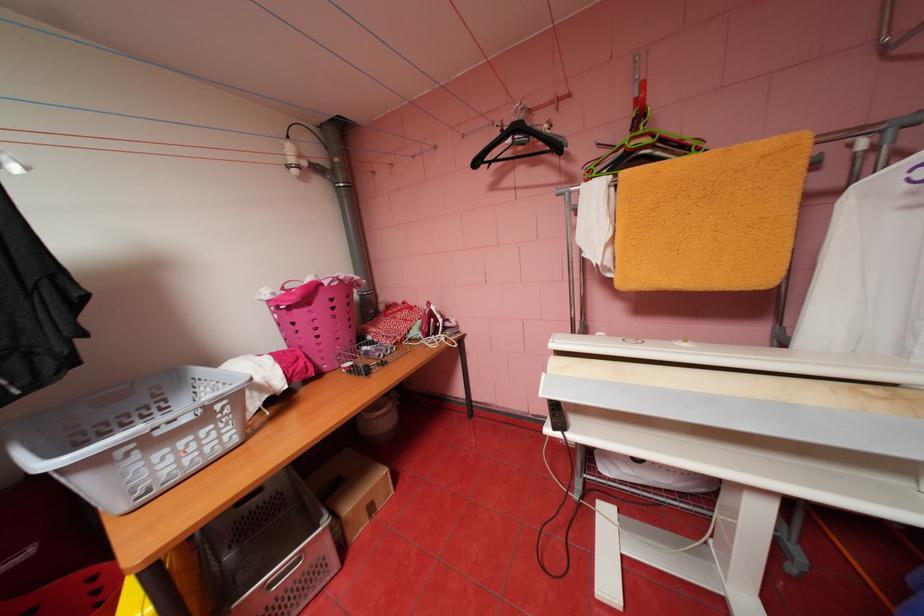
Identify the location of black clothes hanger. The image size is (924, 616). (517, 144).